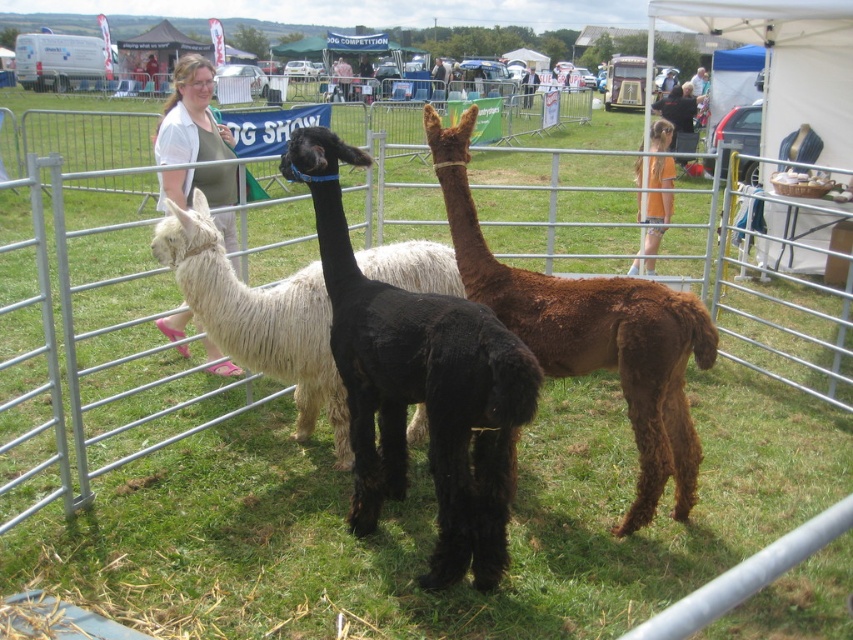
You are at the fair and see the black fuzzy alpaca at center and the matte white shirt at center. Which one is positioned more to the right side?

The black fuzzy alpaca at center is positioned to the right of the matte white shirt at center, so it is more to the right side.

You are standing at the entrance of the fenced enclosure and want to approach the black fuzzy alpaca at center. What are the coordinates of the alpaca from your perspective?

The coordinates of the black fuzzy alpaca at center are at point (x=419, y=385).

You are at the fair and want to take a photo of the white fluffy alpaca at left and the orange cotton shirt at upper right. Which object is wider?

The white fluffy alpaca at left is wider than the orange cotton shirt at upper right.